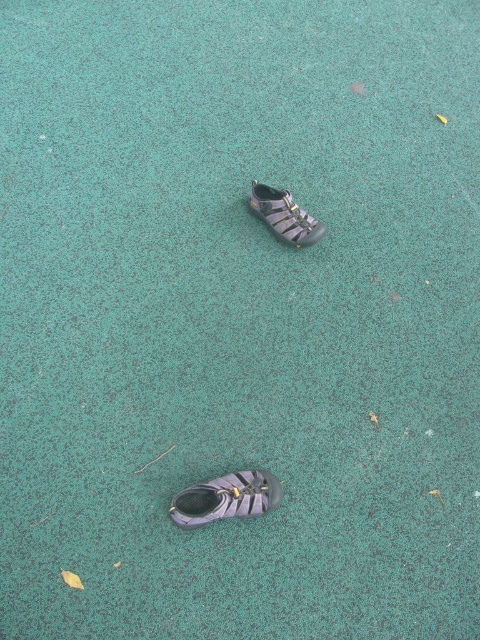
Question: Is purple fabric sandal at lower center to the left of black rubber sandal at center from the viewer's perspective?

Choices:
 (A) no
 (B) yes

Answer: (B)

Question: Which point is closer to the camera?

Choices:
 (A) black rubber sandal at center
 (B) purple fabric sandal at lower center

Answer: (B)

Question: Observing the image, what is the correct spatial positioning of purple fabric sandal at lower center in reference to black rubber sandal at center?

Choices:
 (A) right
 (B) left

Answer: (B)

Question: Can you confirm if purple fabric sandal at lower center is bigger than black rubber sandal at center?

Choices:
 (A) yes
 (B) no

Answer: (B)

Question: Which point is farther to the camera?

Choices:
 (A) (244, 496)
 (B) (282, 193)

Answer: (B)